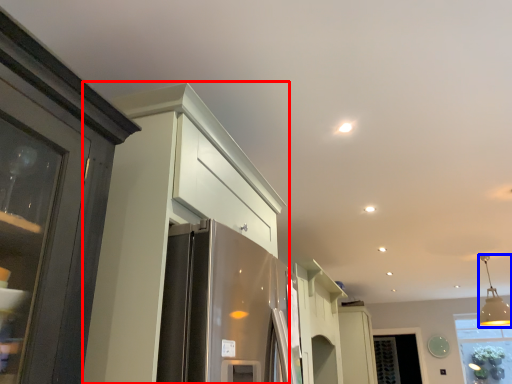
Question: Which point is closer to the camera, cabinetry (highlighted by a red box) or light fixture (highlighted by a blue box)?

Choices:
 (A) cabinetry
 (B) light fixture

Answer: (A)